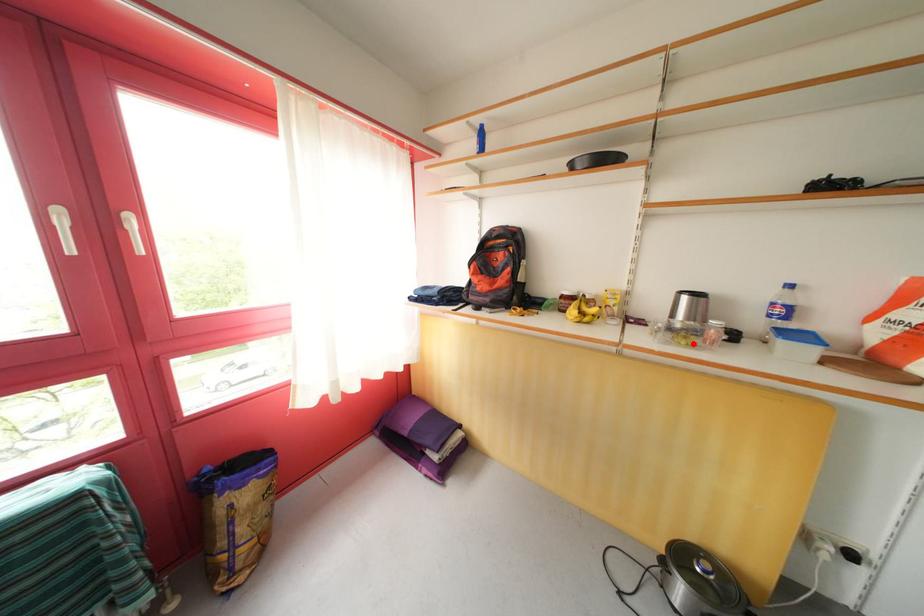
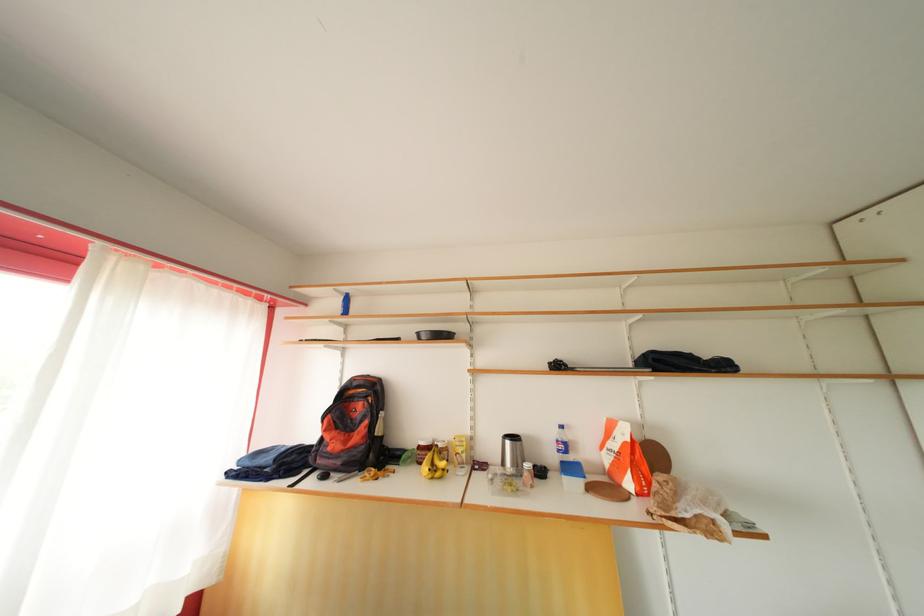
Find the pixel in the second image that matches the highlighted location in the first image.

(517, 490)